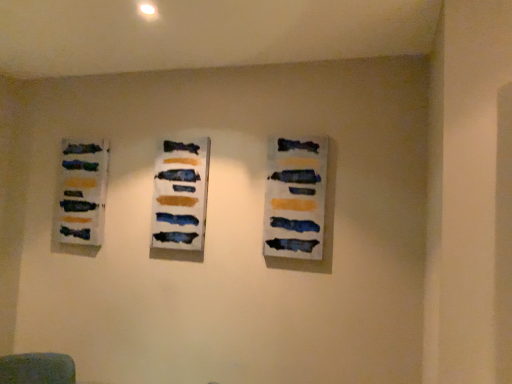
Question: Does textured acrylic painting at left, acting as the third art exhibition starting from the right, turn towards matte acrylic painting at center, the second art exhibition viewed from the front?

Choices:
 (A) no
 (B) yes

Answer: (A)

Question: Is textured acrylic painting at left, the 1th art exhibition when ordered from left to right, positioned with its back to matte acrylic painting at center, acting as the 2th art exhibition starting from the back?

Choices:
 (A) yes
 (B) no

Answer: (B)

Question: Considering the relative sizes of textured acrylic painting at left, acting as the first art exhibition starting from the back, and matte acrylic painting at center, the second art exhibition viewed from the front, in the image provided, is textured acrylic painting at left, acting as the first art exhibition starting from the back, shorter than matte acrylic painting at center, the second art exhibition viewed from the front,?

Choices:
 (A) no
 (B) yes

Answer: (B)

Question: Is textured acrylic painting at left, acting as the 3th art exhibition starting from the front, further to camera compared to matte acrylic painting at center, acting as the 2th art exhibition starting from the back?

Choices:
 (A) yes
 (B) no

Answer: (A)

Question: Considering the relative sizes of textured acrylic painting at left, acting as the third art exhibition starting from the right, and matte acrylic painting at center, which ranks as the second art exhibition in right-to-left order, in the image provided, is textured acrylic painting at left, acting as the third art exhibition starting from the right, bigger than matte acrylic painting at center, which ranks as the second art exhibition in right-to-left order,?

Choices:
 (A) no
 (B) yes

Answer: (B)

Question: Based on their positions, is matte acrylic painting at center, acting as the 2th art exhibition starting from the back, located to the left or right of textured acrylic painting at left, acting as the first art exhibition starting from the back?

Choices:
 (A) left
 (B) right

Answer: (B)

Question: Relative to textured acrylic painting at left, acting as the third art exhibition starting from the right, is matte acrylic painting at center, which ranks as the second art exhibition in right-to-left order, in front or behind?

Choices:
 (A) front
 (B) behind

Answer: (A)

Question: In terms of size, does matte acrylic painting at center, which ranks as the 2th art exhibition in left-to-right order, appear bigger or smaller than textured acrylic painting at left, acting as the first art exhibition starting from the back?

Choices:
 (A) big
 (B) small

Answer: (B)

Question: Is matte acrylic painting at center, which ranks as the second art exhibition in right-to-left order, inside the boundaries of textured acrylic painting at left, the 1th art exhibition when ordered from left to right, or outside?

Choices:
 (A) inside
 (B) outside

Answer: (B)

Question: In the image, is textured acrylic painting at left, acting as the third art exhibition starting from the right, on the left side or the right side of matte acrylic painting at center, acting as the 2th art exhibition starting from the back?

Choices:
 (A) left
 (B) right

Answer: (A)

Question: From the image's perspective, is textured acrylic painting at left, the 1th art exhibition when ordered from left to right, above or below matte acrylic painting at center, acting as the 2th art exhibition starting from the back?

Choices:
 (A) above
 (B) below

Answer: (A)

Question: Looking at their shapes, would you say textured acrylic painting at left, acting as the 3th art exhibition starting from the front, is wider or thinner than matte acrylic painting at center, which ranks as the 2th art exhibition in left-to-right order?

Choices:
 (A) thin
 (B) wide

Answer: (B)

Question: Is textured acrylic painting at left, acting as the first art exhibition starting from the back, in front of or behind matte acrylic painting at center, which ranks as the second art exhibition in right-to-left order, in the image?

Choices:
 (A) behind
 (B) front

Answer: (A)

Question: Is matte acrylic painting at center, marked as the first art exhibition in a front-to-back arrangement, spatially inside textured acrylic painting at left, acting as the first art exhibition starting from the back, or outside of it?

Choices:
 (A) inside
 (B) outside

Answer: (B)

Question: From a real-world perspective, is matte acrylic painting at center, marked as the first art exhibition in a front-to-back arrangement, positioned above or below textured acrylic painting at left, acting as the first art exhibition starting from the back?

Choices:
 (A) below
 (B) above

Answer: (B)